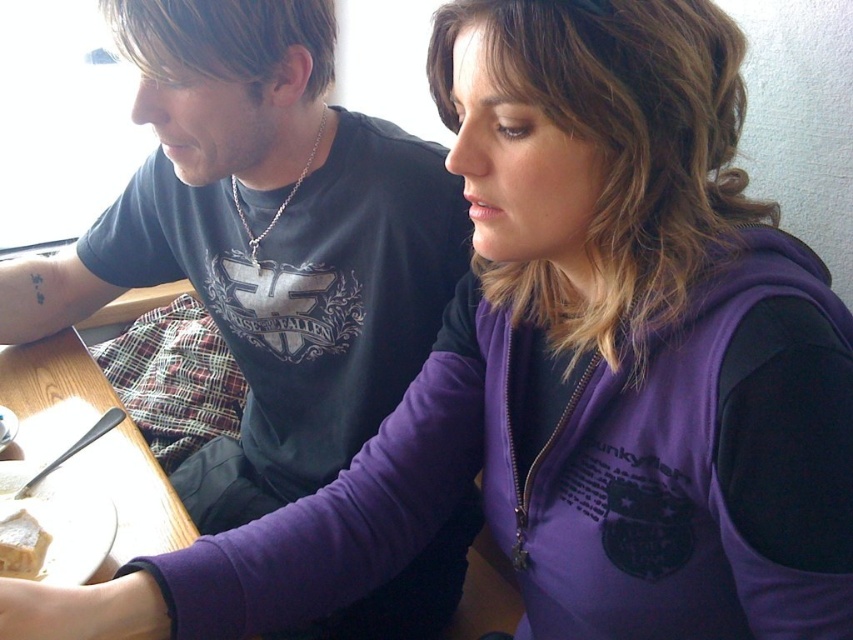
Question: Is matte black shirt at upper left further to the viewer compared to wooden table at lower left?

Choices:
 (A) yes
 (B) no

Answer: (A)

Question: Is matte black shirt at upper left to the left of wooden table at lower left from the viewer's perspective?

Choices:
 (A) no
 (B) yes

Answer: (A)

Question: Which object is closer to the camera taking this photo?

Choices:
 (A) wooden table at lower left
 (B) matte black shirt at upper left

Answer: (A)

Question: Is matte black shirt at upper left positioned behind white crumbly cake at lower left?

Choices:
 (A) no
 (B) yes

Answer: (B)

Question: Which object appears closest to the camera in this image?

Choices:
 (A) white crumbly cake at lower left
 (B) wooden table at lower left
 (C) matte black shirt at upper left

Answer: (B)

Question: Estimate the real-world distances between objects in this image. Which object is farther from the white crumbly cake at lower left?

Choices:
 (A) matte black shirt at upper left
 (B) wooden table at lower left

Answer: (A)